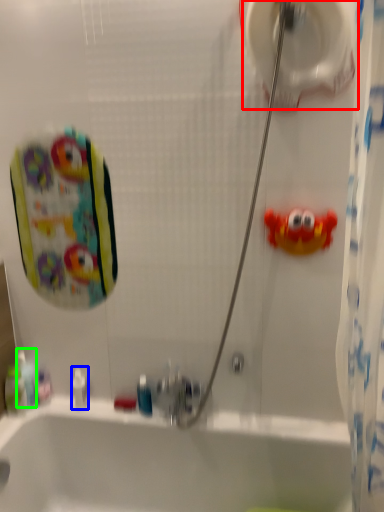
Question: Which object is positioned farthest from toilet paper (highlighted by a red box)? Select from toiletry (highlighted by a blue box) and mouthwash (highlighted by a green box).

Choices:
 (A) toiletry
 (B) mouthwash

Answer: (B)